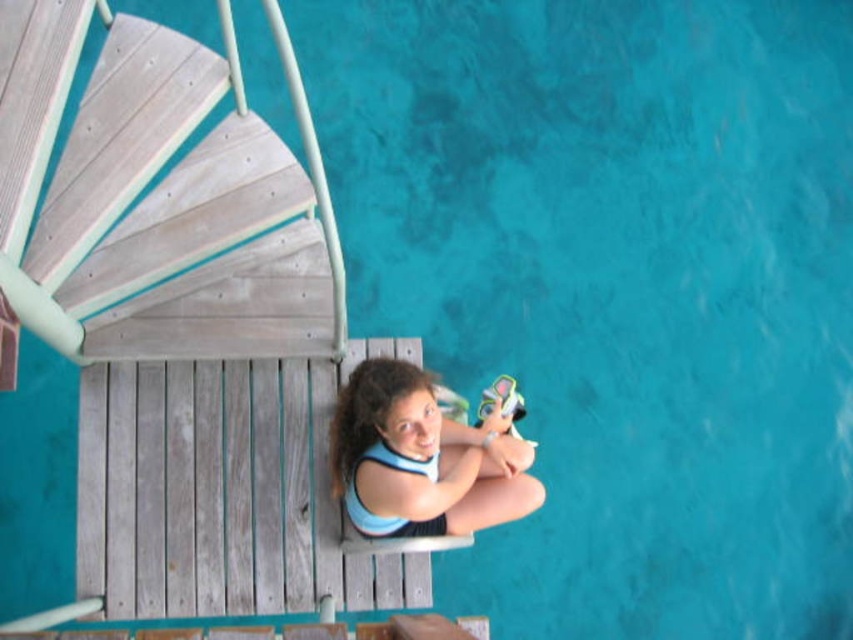
Between light gray wood stairs at upper left and blue fabric girl at center, which one is positioned higher?

Positioned higher is light gray wood stairs at upper left.

Which is behind, point (99, 122) or point (520, 483)?

The point (520, 483) is more distant.

This screenshot has width=853, height=640. Identify the location of light gray wood stairs at upper left. (166, 196).